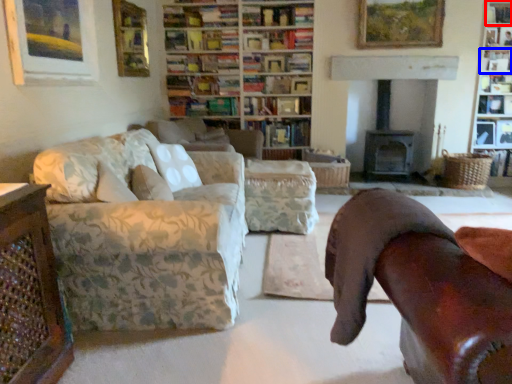
Question: Which object appears farthest to the camera in this image, shelf (highlighted by a red box) or shelf (highlighted by a blue box)?

Choices:
 (A) shelf
 (B) shelf

Answer: (B)